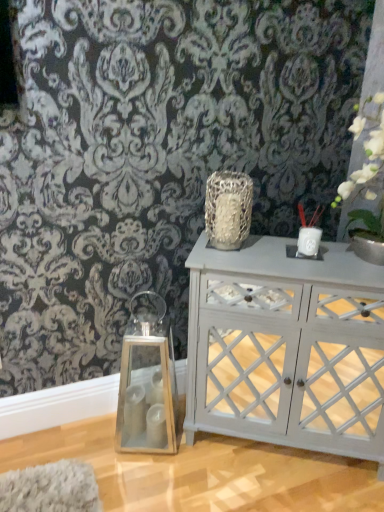
This screenshot has height=512, width=384. Identify the location of free spot above white painted wood cabinet at center (from a real-world perspective). click(x=298, y=260).